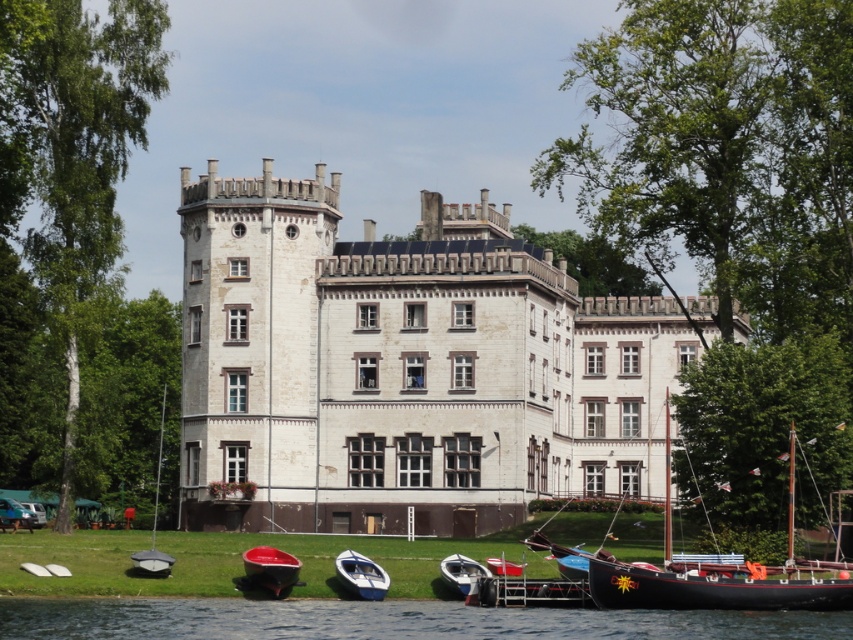
You are a visitor standing on the grassy area in front of the historic building. You want to take a photo of both the white glossy boat at lower center and the metallic gray sailboat at lower left. Which boat should you position closer to the camera to ensure both are fully visible in the frame?

You should position the metallic gray sailboat at lower left closer to the camera because it is taller than the white glossy boat at lower center. This way, both boats will fit within the camera frame without any part being cut off.

You are standing on the dock and see both the wooden sailboat at lower right and the white glossy boat at lower center. Which boat is positioned higher relative to the other?

The wooden sailboat at lower right is positioned higher than the white glossy boat at lower center because it is above it.

You are an architect designing a new bridge that needs to pass over both the wooden sailboat at lower right and the white glossy boat at lower center. The bridge must be at least 2 meters above the tallest boat. What is the minimum height the bridge should be?

The wooden sailboat at lower right is much taller than the white glossy boat at lower center. Therefore, the bridge must be at least 2 meters above the wooden sailboat at lower right to meet the requirement.